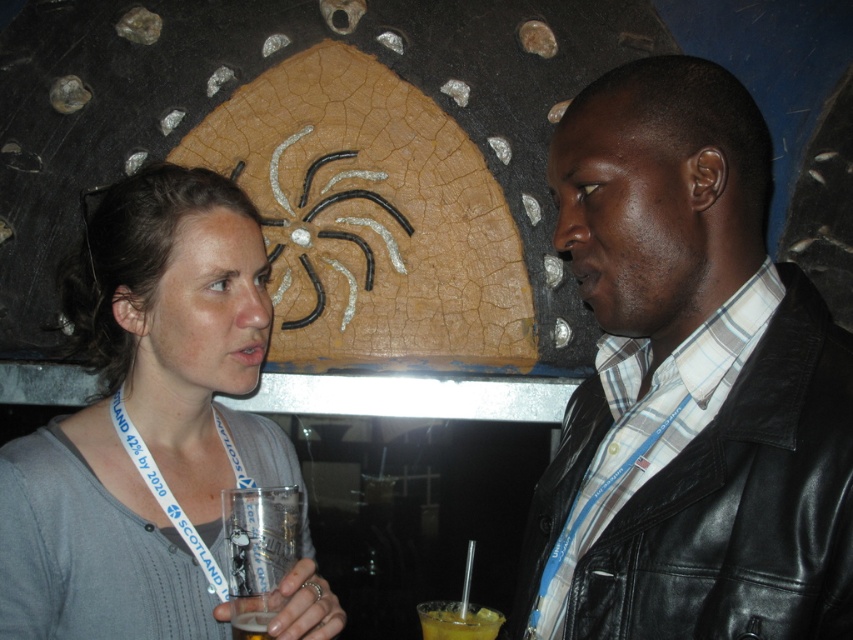
Question: Does gray cotton shirt at left have a greater width compared to clear plastic cup at lower left?

Choices:
 (A) no
 (B) yes

Answer: (B)

Question: Which of the following is the farthest from the observer?

Choices:
 (A) yellow translucent drink at lower center
 (B) black leather jacket at center
 (C) gray cotton shirt at left
 (D) translucent plastic cup at lower left

Answer: (A)

Question: Can you confirm if black leather jacket at center is wider than gray cotton shirt at left?

Choices:
 (A) no
 (B) yes

Answer: (A)

Question: Considering the real-world distances, which object is closest to the clear plastic cup at lower left?

Choices:
 (A) black leather jacket at center
 (B) translucent plastic cup at lower left
 (C) gray cotton shirt at left

Answer: (B)

Question: Estimate the real-world distances between objects in this image. Which object is farther from the black leather jacket at center?

Choices:
 (A) translucent plastic cup at lower left
 (B) clear plastic cup at lower left
 (C) gray cotton shirt at left
 (D) yellow translucent drink at lower center

Answer: (A)

Question: Can you confirm if clear plastic cup at lower left is positioned below translucent plastic cup at lower left?

Choices:
 (A) no
 (B) yes

Answer: (A)